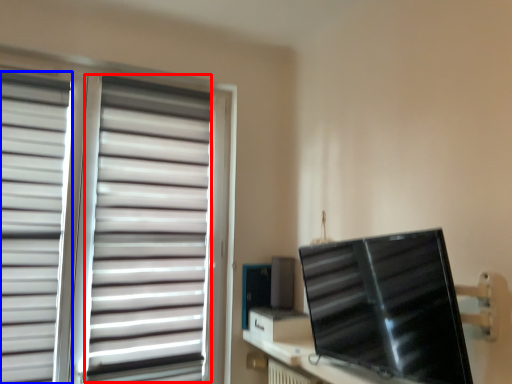
Question: Which object appears closest to the camera in this image, curtain (highlighted by a red box) or curtain (highlighted by a blue box)?

Choices:
 (A) curtain
 (B) curtain

Answer: (B)